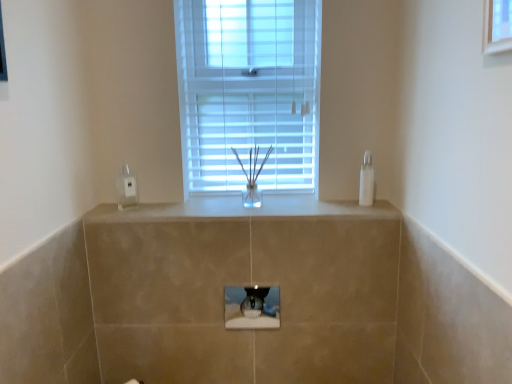
Question: Is white glossy counter top at center far from transparent plastic soap dispenser at right?

Choices:
 (A) no
 (B) yes

Answer: (A)

Question: Can you confirm if white glossy counter top at center is positioned to the left of transparent plastic soap dispenser at right?

Choices:
 (A) no
 (B) yes

Answer: (B)

Question: Can you confirm if white glossy counter top at center is smaller than transparent plastic soap dispenser at right?

Choices:
 (A) yes
 (B) no

Answer: (B)

Question: Is white glossy counter top at center positioned behind transparent plastic soap dispenser at right?

Choices:
 (A) no
 (B) yes

Answer: (A)

Question: From a real-world perspective, is white glossy counter top at center located higher than transparent plastic soap dispenser at right?

Choices:
 (A) no
 (B) yes

Answer: (A)

Question: Considering the positions of point (245, 289) and point (135, 193), is point (245, 289) closer or farther from the camera than point (135, 193)?

Choices:
 (A) farther
 (B) closer

Answer: (B)

Question: Is transparent glass hole at center spatially inside clear plastic electric outlet at left, or outside of it?

Choices:
 (A) inside
 (B) outside

Answer: (B)

Question: Is transparent glass hole at center wider or thinner than clear plastic electric outlet at left?

Choices:
 (A) wide
 (B) thin

Answer: (B)

Question: Based on their positions, is transparent glass hole at center located to the left or right of clear plastic electric outlet at left?

Choices:
 (A) right
 (B) left

Answer: (A)

Question: Considering the positions of white glossy counter top at center and white plastic window at center in the image, is white glossy counter top at center wider or thinner than white plastic window at center?

Choices:
 (A) thin
 (B) wide

Answer: (B)

Question: From a real-world perspective, is white glossy counter top at center physically located above or below white plastic window at center?

Choices:
 (A) below
 (B) above

Answer: (A)

Question: From the image's perspective, is white glossy counter top at center located above or below white plastic window at center?

Choices:
 (A) above
 (B) below

Answer: (B)

Question: From their relative heights in the image, would you say white glossy counter top at center is taller or shorter than white plastic window at center?

Choices:
 (A) tall
 (B) short

Answer: (B)

Question: Choose the correct answer: Is clear plastic electric outlet at left inside transparent plastic soap dispenser at right or outside it?

Choices:
 (A) inside
 (B) outside

Answer: (B)

Question: Considering the positions of clear plastic electric outlet at left and transparent plastic soap dispenser at right in the image, is clear plastic electric outlet at left wider or thinner than transparent plastic soap dispenser at right?

Choices:
 (A) wide
 (B) thin

Answer: (B)